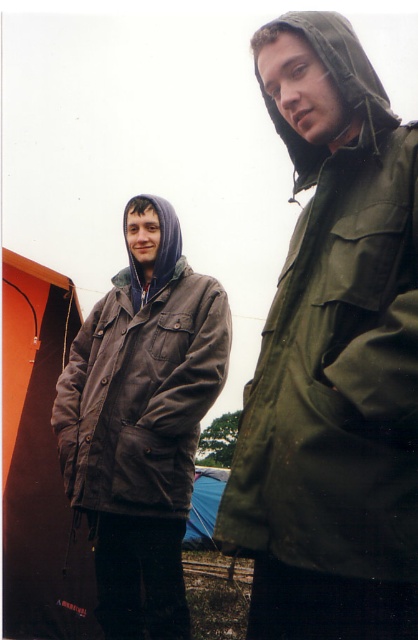
Question: Estimate the real-world distances between objects in this image. Which object is closer to the green matte hood at upper right?

Choices:
 (A) blue fabric tent at lower center
 (B) brown leather jacket at left

Answer: (B)

Question: Is brown leather jacket at left positioned before blue fabric tent at lower center?

Choices:
 (A) yes
 (B) no

Answer: (A)

Question: Is green matte hood at upper right closer to the viewer compared to blue fabric tent at lower center?

Choices:
 (A) no
 (B) yes

Answer: (B)

Question: Which point appears farthest from the camera in this image?

Choices:
 (A) (214, 476)
 (B) (349, 108)
 (C) (257, 451)
 (D) (198, 289)

Answer: (A)

Question: Does matte olive-green jacket at center come in front of green matte hood at upper right?

Choices:
 (A) no
 (B) yes

Answer: (B)

Question: Estimate the real-world distances between objects in this image. Which object is closer to the matte olive-green jacket at center?

Choices:
 (A) green matte hood at upper right
 (B) brown leather jacket at left

Answer: (A)